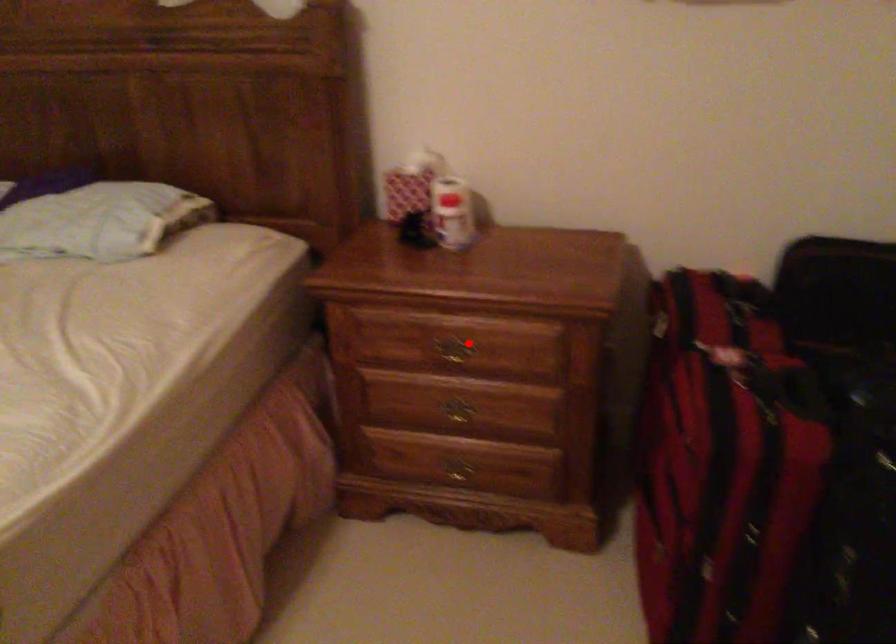
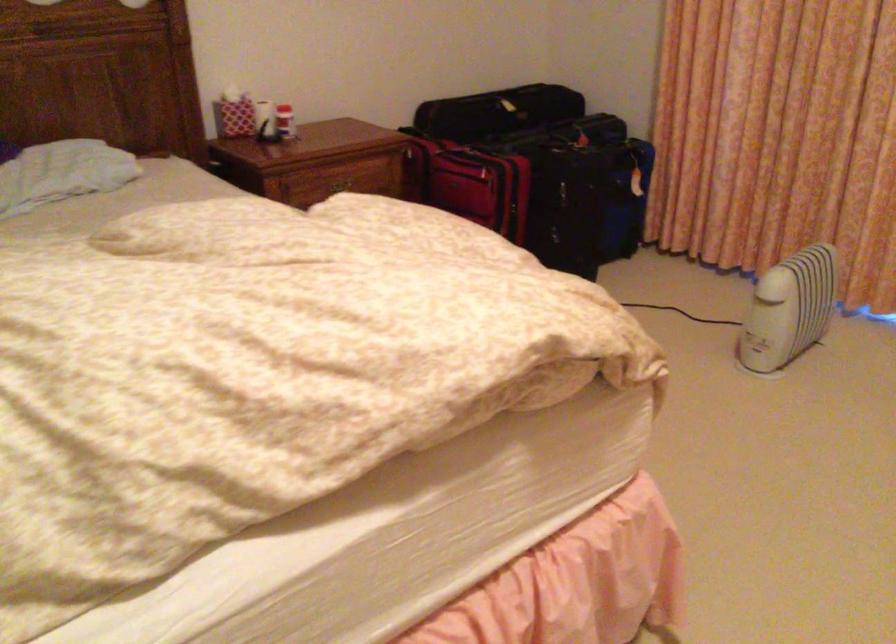
In the second image, find the point that corresponds to the highlighted location in the first image.

(338, 185)